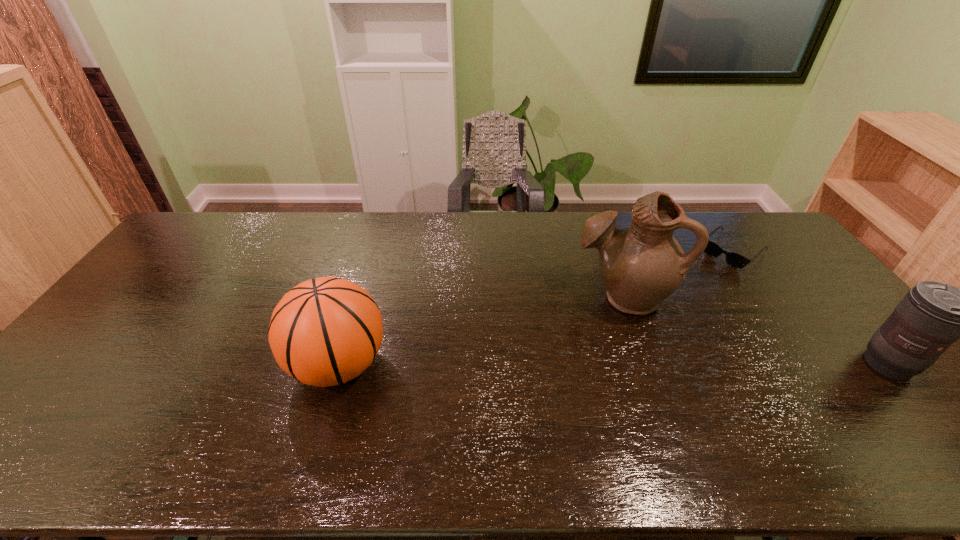
Where is `free location located at the spout of the pitcher`? This screenshot has height=540, width=960. free location located at the spout of the pitcher is located at coordinates (581, 334).

At what (x,y) coordinates should I click in order to perform the action: click on free space located at the spout of the pitcher. Please return your answer as a coordinate pair (x, y). Looking at the image, I should click on (561, 355).

This screenshot has width=960, height=540. Find the location of `vacant space located at the spout of the pitcher`. vacant space located at the spout of the pitcher is located at coordinates (564, 353).

You are a GUI agent. You are given a task and a screenshot of the screen. Output one action in this format:
    pyautogui.click(x=<x>, y=<y>)
    Task: Click on the object that is at the far edge
    This screenshot has width=960, height=540.
    Given the screenshot: What is the action you would take?
    pyautogui.click(x=733, y=259)

The image size is (960, 540). I want to click on object located at the near edge, so click(325, 331).

Where is `telephoto lens positioned at the right edge`? The width and height of the screenshot is (960, 540). telephoto lens positioned at the right edge is located at coordinates (932, 315).

I want to click on sunglasses that is positioned at the right edge, so click(x=733, y=259).

Where is `object located at the far right corner`? Image resolution: width=960 pixels, height=540 pixels. object located at the far right corner is located at coordinates (733, 259).

Image resolution: width=960 pixels, height=540 pixels. I want to click on vacant space at the far edge of the desktop, so click(x=564, y=230).

At what (x,y) coordinates should I click in order to perform the action: click on free point at the near edge. Please return your answer as a coordinate pair (x, y). The image size is (960, 540). Looking at the image, I should click on (347, 411).